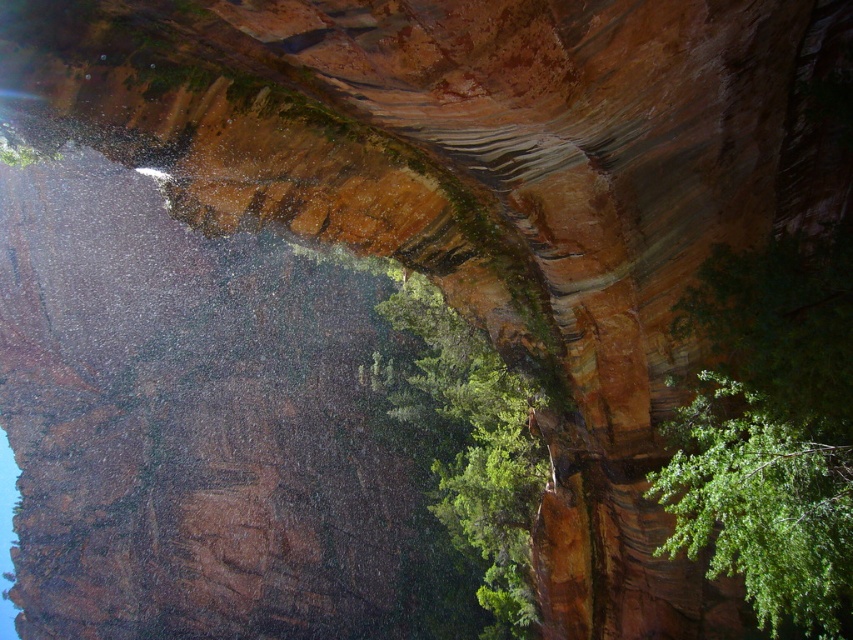
Is green leafy tree at right wider than green leafy tree at center?

No, green leafy tree at right is not wider than green leafy tree at center.

Between green leafy tree at right and green leafy tree at center, which one is positioned higher?

green leafy tree at right is higher up.

What do you see at coordinates (769, 490) in the screenshot? This screenshot has height=640, width=853. I see `green leafy tree at right` at bounding box center [769, 490].

The image size is (853, 640). Find the location of `green leafy tree at right`. green leafy tree at right is located at coordinates click(x=769, y=490).